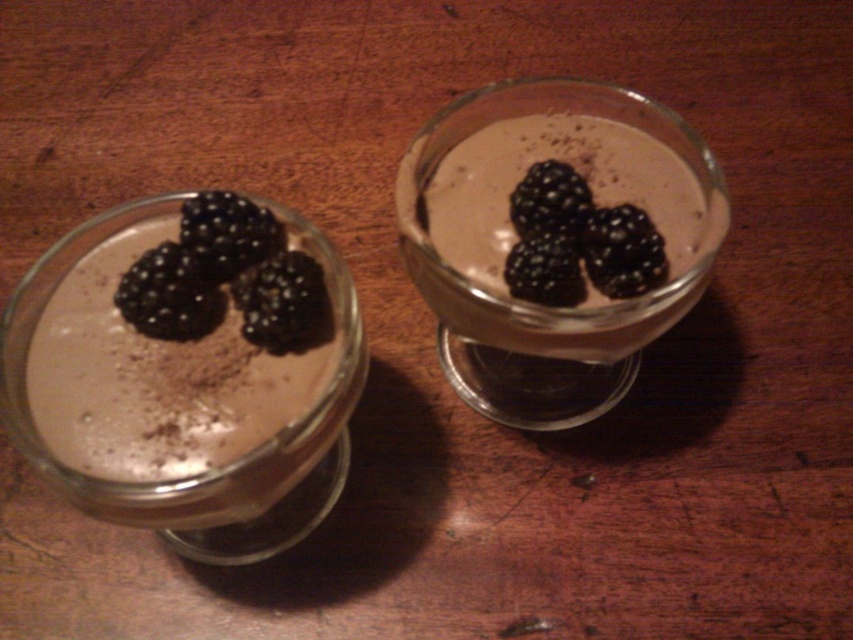
Between point (476, 291) and point (320, 330), which one is positioned in front?

Positioned in front is point (320, 330).

Does point (506, 419) come closer to viewer compared to point (294, 304)?

No, (506, 419) is behind (294, 304).

Locate an element on the screen. The height and width of the screenshot is (640, 853). matte glass dessert at upper center is located at coordinates (537, 305).

Does matte chocolate pudding at left lie in front of matte black berry at left?

Yes.

Who is more distant from viewer, (170, 376) or (143, 280)?

The point (170, 376) is more distant.

This screenshot has width=853, height=640. Find the location of `matte chocolate pudding at left`. matte chocolate pudding at left is located at coordinates (167, 384).

Which is more to the right, matte black berry at left or black matte/blackberry at upper center?

black matte/blackberry at upper center

Does matte black berry at left have a larger size compared to black matte/blackberry at upper center?

Correct, matte black berry at left is larger in size than black matte/blackberry at upper center.

Find the location of a particular element. Image resolution: width=853 pixels, height=640 pixels. matte black berry at left is located at coordinates (169, 294).

Where is `matte black berry at left`? Image resolution: width=853 pixels, height=640 pixels. matte black berry at left is located at coordinates tap(169, 294).